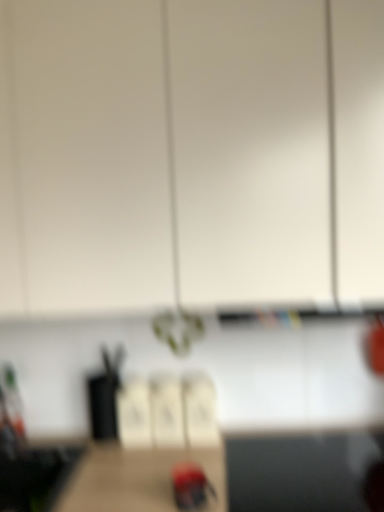
Question: Is white matte cabinet at upper center inside or outside of smooth red woodpecker at center?

Choices:
 (A) outside
 (B) inside

Answer: (A)

Question: From a real-world perspective, relative to smooth red woodpecker at center, is white matte cabinet at upper center vertically above or below?

Choices:
 (A) below
 (B) above

Answer: (B)

Question: From the image's perspective, relative to smooth red woodpecker at center, is white matte cabinet at upper center above or below?

Choices:
 (A) below
 (B) above

Answer: (B)

Question: From the image's perspective, is smooth red woodpecker at center located above or below white matte cabinet at upper center?

Choices:
 (A) below
 (B) above

Answer: (A)

Question: From a real-world perspective, is smooth red woodpecker at center positioned above or below white matte cabinet at upper center?

Choices:
 (A) above
 (B) below

Answer: (B)

Question: Is smooth red woodpecker at center spatially inside white matte cabinet at upper center, or outside of it?

Choices:
 (A) outside
 (B) inside

Answer: (A)

Question: Considering the positions of point pyautogui.click(x=200, y=494) and point pyautogui.click(x=271, y=68), is point pyautogui.click(x=200, y=494) closer or farther from the camera than point pyautogui.click(x=271, y=68)?

Choices:
 (A) closer
 (B) farther

Answer: (B)